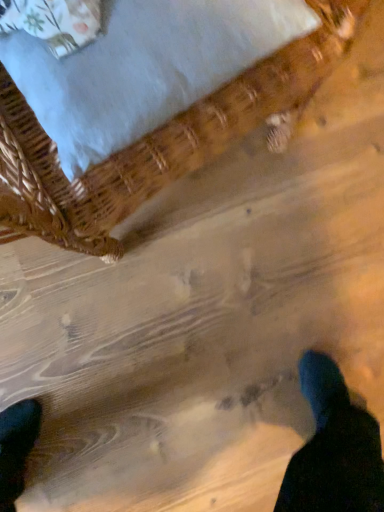
Image resolution: width=384 pixels, height=512 pixels. What do you see at coordinates (152, 143) in the screenshot?
I see `woven wood basket at upper left` at bounding box center [152, 143].

Locate an element on the screen. This screenshot has width=384, height=512. woven wood basket at upper left is located at coordinates (152, 143).

Find the location of a particular element. woven wood basket at upper left is located at coordinates (152, 143).